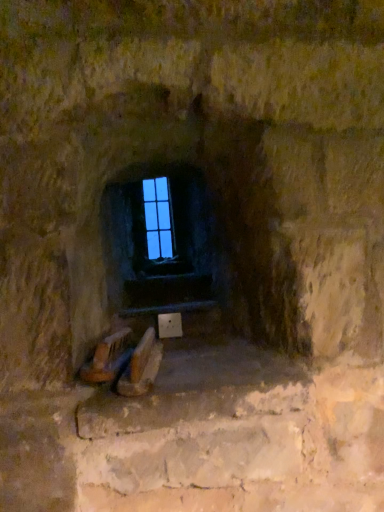
The height and width of the screenshot is (512, 384). In order to click on transparent glass window at center in this screenshot , I will do `click(158, 218)`.

The image size is (384, 512). Describe the element at coordinates (158, 218) in the screenshot. I see `transparent glass window at center` at that location.

This screenshot has height=512, width=384. Find the location of `smooth stone stairwell at center`. smooth stone stairwell at center is located at coordinates (167, 294).

What do you see at coordinates (167, 294) in the screenshot? I see `smooth stone stairwell at center` at bounding box center [167, 294].

Identify the location of transparent glass window at center. The width and height of the screenshot is (384, 512). (158, 218).

Considering the relative positions of smooth stone stairwell at center and transparent glass window at center in the image provided, is smooth stone stairwell at center to the left or to the right of transparent glass window at center?

smooth stone stairwell at center is to the right of transparent glass window at center.

Is smooth stone stairwell at center in front of or behind transparent glass window at center in the image?

smooth stone stairwell at center is in front of transparent glass window at center.

Considering the positions of points (135, 298) and (164, 200), is point (135, 298) closer to camera compared to point (164, 200)?

Yes.

From the image's perspective, which is below, smooth stone stairwell at center or transparent glass window at center?

From the image's view, smooth stone stairwell at center is below.

Consider the image. From a real-world perspective, which is physically below, smooth stone stairwell at center or transparent glass window at center?

smooth stone stairwell at center is physically lower.

Does smooth stone stairwell at center have a lesser width compared to transparent glass window at center?

No, smooth stone stairwell at center is not thinner than transparent glass window at center.

Who is taller, smooth stone stairwell at center or transparent glass window at center?

transparent glass window at center.

Is smooth stone stairwell at center smaller than transparent glass window at center?

Incorrect, smooth stone stairwell at center is not smaller in size than transparent glass window at center.

Do you think smooth stone stairwell at center is within transparent glass window at center, or outside of it?

smooth stone stairwell at center is not enclosed by transparent glass window at center.

Is the surface of smooth stone stairwell at center in direct contact with transparent glass window at center?

No, smooth stone stairwell at center is not next to transparent glass window at center.

Is smooth stone stairwell at center positioned with its back to transparent glass window at center?

smooth stone stairwell at center is not turned away from transparent glass window at center.

What's the angular difference between smooth stone stairwell at center and transparent glass window at center's facing directions?

The angular difference between smooth stone stairwell at center and transparent glass window at center is 2.47 degrees.

The width and height of the screenshot is (384, 512). In order to click on glass window on the left of the smooth stone stairwell at center in this screenshot , I will do `click(158, 218)`.

Would you say transparent glass window at center is to the left or to the right of smooth stone stairwell at center in the picture?

Based on their positions, transparent glass window at center is located to the left of smooth stone stairwell at center.

Based on the photo, does transparent glass window at center lie in front of smooth stone stairwell at center?

No.

Considering the positions of point (152, 196) and point (126, 289), is point (152, 196) closer or farther from the camera than point (126, 289)?

Point (152, 196) is farther from the camera than point (126, 289).

From the image's perspective, does transparent glass window at center appear higher than smooth stone stairwell at center?

Yes, from the image's perspective, transparent glass window at center is above smooth stone stairwell at center.

From a real-world perspective, is transparent glass window at center below smooth stone stairwell at center?

Incorrect, from a real-world perspective, transparent glass window at center is higher than smooth stone stairwell at center.

Which object is wider, transparent glass window at center or smooth stone stairwell at center?

Wider between the two is smooth stone stairwell at center.

Considering the sizes of objects transparent glass window at center and smooth stone stairwell at center in the image provided, who is taller, transparent glass window at center or smooth stone stairwell at center?

With more height is transparent glass window at center.

Considering the sizes of objects transparent glass window at center and smooth stone stairwell at center in the image provided, who is smaller, transparent glass window at center or smooth stone stairwell at center?

transparent glass window at center is smaller.

Is transparent glass window at center surrounding smooth stone stairwell at center?

That's incorrect, smooth stone stairwell at center is not inside transparent glass window at center.

Is the surface of transparent glass window at center in direct contact with smooth stone stairwell at center?

No, transparent glass window at center is not next to smooth stone stairwell at center.

Is transparent glass window at center facing away from smooth stone stairwell at center?

No, transparent glass window at center's orientation is not away from smooth stone stairwell at center.

Image resolution: width=384 pixels, height=512 pixels. I want to click on stairwell that appears on the right of transparent glass window at center, so click(x=167, y=294).

You are a GUI agent. You are given a task and a screenshot of the screen. Output one action in this format:
    pyautogui.click(x=<x>, y=<y>)
    Task: Click on the stairwell that is under the transparent glass window at center (from a real-world perspective)
    
    Given the screenshot: What is the action you would take?
    pyautogui.click(x=167, y=294)

Where is `stairwell below the transparent glass window at center (from the image's perspective)`? The height and width of the screenshot is (512, 384). stairwell below the transparent glass window at center (from the image's perspective) is located at coordinates (167, 294).